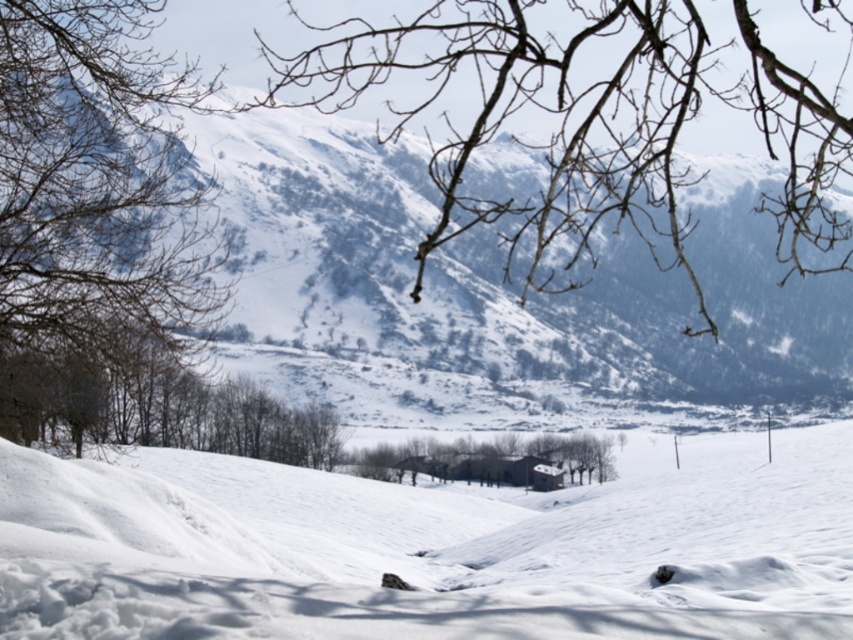
You are an observer looking at the winter landscape. You notice two sets of bare branches in the scene. Which set, the bare branches at upper center or the bare branches at left, appears bigger in size?

The bare branches at upper center has a larger size compared to the bare branches at left.

In the scene shown: You are planning to build a ski lift from the brown wood house at center to the snowy white mountain at upper center. Considering the height difference between them, which direction should the ski lift go?

The snowy white mountain at upper center is taller than the brown wood house at center, so the ski lift should go from the brown wood house at center up to the snowy white mountain at upper center.

You are an artist sketching this winter scene. You want to ensure the proportions between the bare branches at upper center and the bare branches at left are accurate. Which set of branches should you draw wider?

The bare branches at upper center might be wider than the bare branches at left, so you should draw the bare branches at upper center wider.